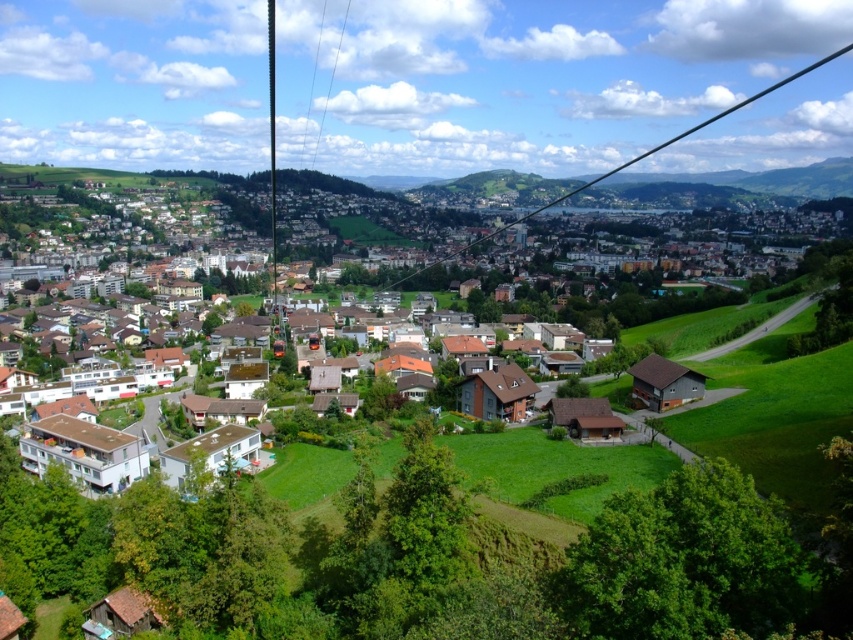
You are a drone operator trying to capture aerial footage of the brown wooden houses at center and the black wire at center. From your current position above the valley, which object would appear lower in your camera view?

The brown wooden houses at center appear lower in the camera view because they are located below the black wire at center.